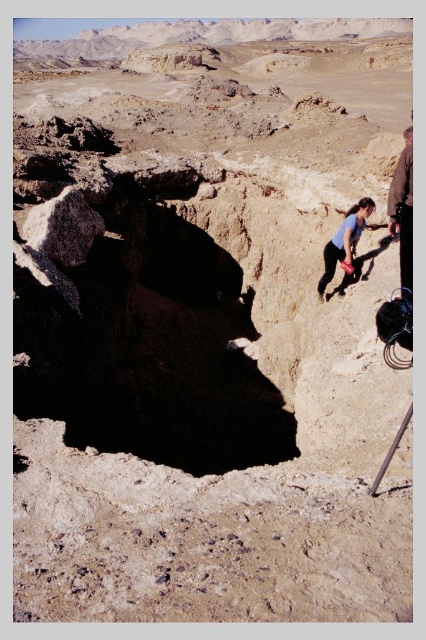
Does brown leather jacket at right appear on the right side of blue fabric shirt at center?

Indeed, brown leather jacket at right is positioned on the right side of blue fabric shirt at center.

Consider the image. Can you confirm if brown leather jacket at right is positioned above blue fabric shirt at center?

Indeed, brown leather jacket at right is positioned over blue fabric shirt at center.

Does point (411, 198) come closer to viewer compared to point (334, 260)?

Yes, it is in front of point (334, 260).

This screenshot has width=426, height=640. In order to click on brown leather jacket at right in this screenshot , I will do `click(402, 209)`.

The width and height of the screenshot is (426, 640). Identify the location of dark gray rough rock at left. (63, 227).

Which is in front, point (45, 230) or point (394, 216)?

Point (394, 216)

Identify the location of dark gray rough rock at left. (63, 227).

Can you confirm if dark gray rough rock at left is positioned above blue fabric shirt at center?

Yes.

Who is shorter, dark gray rough rock at left or blue fabric shirt at center?

dark gray rough rock at left

You are a GUI agent. You are given a task and a screenshot of the screen. Output one action in this format:
    pyautogui.click(x=<x>, y=<y>)
    Task: Click on the dark gray rough rock at left
    
    Given the screenshot: What is the action you would take?
    pyautogui.click(x=63, y=227)

In order to click on dark gray rough rock at left in this screenshot , I will do `click(63, 227)`.